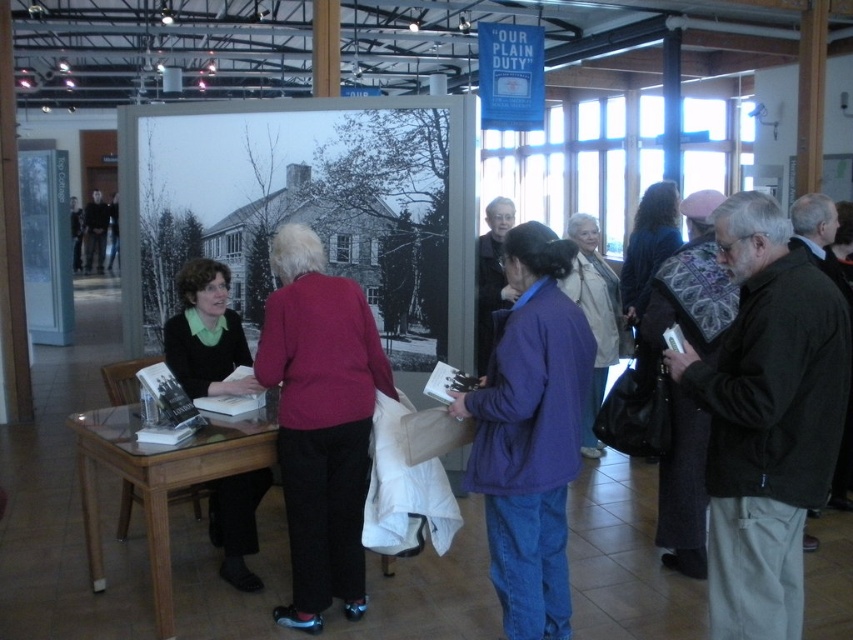
In the scene shown: You are standing in the museum and want to know which of the two points, point (732, 573) or point (119, 444), is closer to you. Can you determine this based on the scene?

Point (732, 573) is closer to the viewer than point (119, 444).

You are a visitor at the museum and want to place your dark brown jacket at center on the clear glass table at lower left. Will it fit?

The dark brown jacket at center is thinner than the clear glass table at lower left, so it will fit on the table.